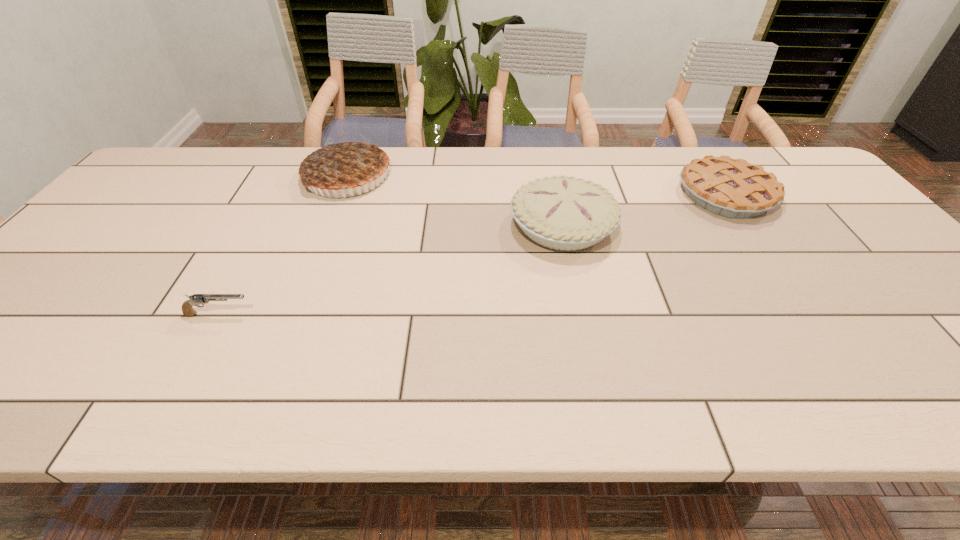
Identify the location of vacant region located aiming along the barrel of the gun. The width and height of the screenshot is (960, 540). (430, 314).

At what (x,y) coordinates should I click in order to perform the action: click on vacant space at the far edge. Please return your answer as a coordinate pair (x, y). Image resolution: width=960 pixels, height=540 pixels. Looking at the image, I should click on (233, 157).

The height and width of the screenshot is (540, 960). In order to click on vacant area at the near edge in this screenshot , I will do `click(343, 402)`.

In order to click on vacant space at the left edge of the desktop in this screenshot , I will do `click(165, 208)`.

Locate an element on the screen. The height and width of the screenshot is (540, 960). vacant space at the right edge of the desktop is located at coordinates (921, 333).

You are a GUI agent. You are given a task and a screenshot of the screen. Output one action in this format:
    pyautogui.click(x=<x>, y=<y>)
    Task: Click on the free space between the second object from right to left and the nearest object
    This screenshot has width=960, height=540.
    Given the screenshot: What is the action you would take?
    pyautogui.click(x=391, y=270)

Locate an element on the screen. The width and height of the screenshot is (960, 540). vacant space that's between the second shortest pie and the nearest object is located at coordinates (391, 270).

Locate an element on the screen. empty space between the second object from right to left and the rightmost object is located at coordinates (644, 210).

Identify the location of empty space that is in between the leftmost pie and the second tallest pie. Image resolution: width=960 pixels, height=540 pixels. (455, 201).

Locate an element on the screen. The image size is (960, 540). free space between the nearest object and the leftmost pie is located at coordinates (283, 245).